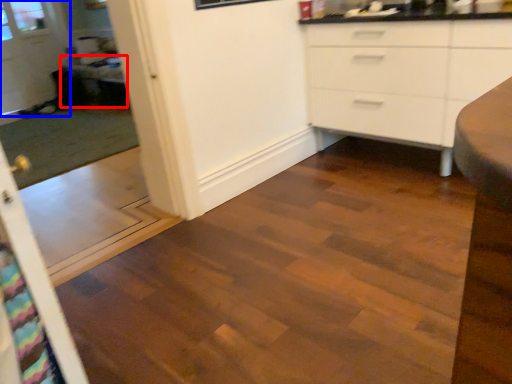
Question: Which object is closer to the camera taking this photo, table (highlighted by a red box) or glass door (highlighted by a blue box)?

Choices:
 (A) table
 (B) glass door

Answer: (A)